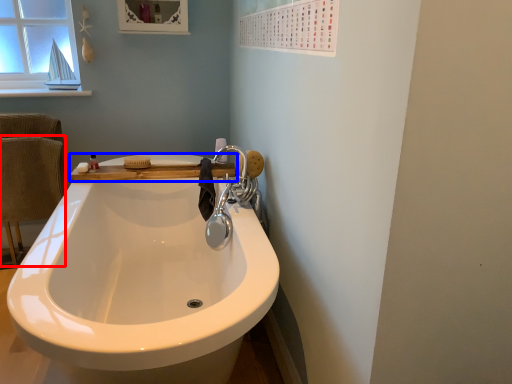
Question: Which point is closer to the camera, armchair (highlighted by a red box) or counter top (highlighted by a blue box)?

Choices:
 (A) armchair
 (B) counter top

Answer: (B)